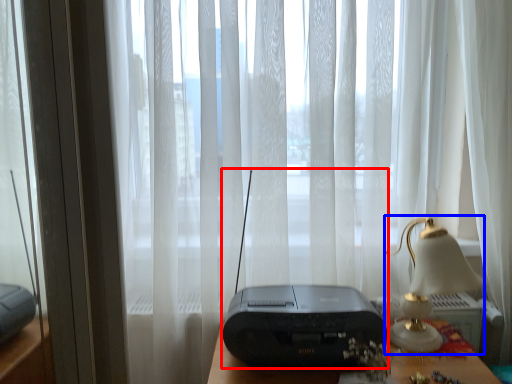
Question: Which object appears closest to the camera in this image, gadget (highlighted by a red box) or table lamp (highlighted by a blue box)?

Choices:
 (A) gadget
 (B) table lamp

Answer: (A)